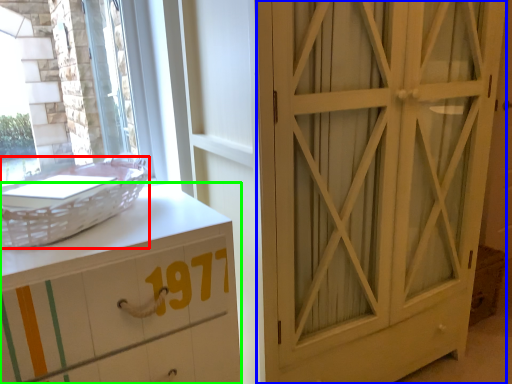
Question: Considering the real-world distances, which object is farthest from basket (highlighted by a red box)? door (highlighted by a blue box) or chest of drawers (highlighted by a green box)?

Choices:
 (A) door
 (B) chest of drawers

Answer: (A)